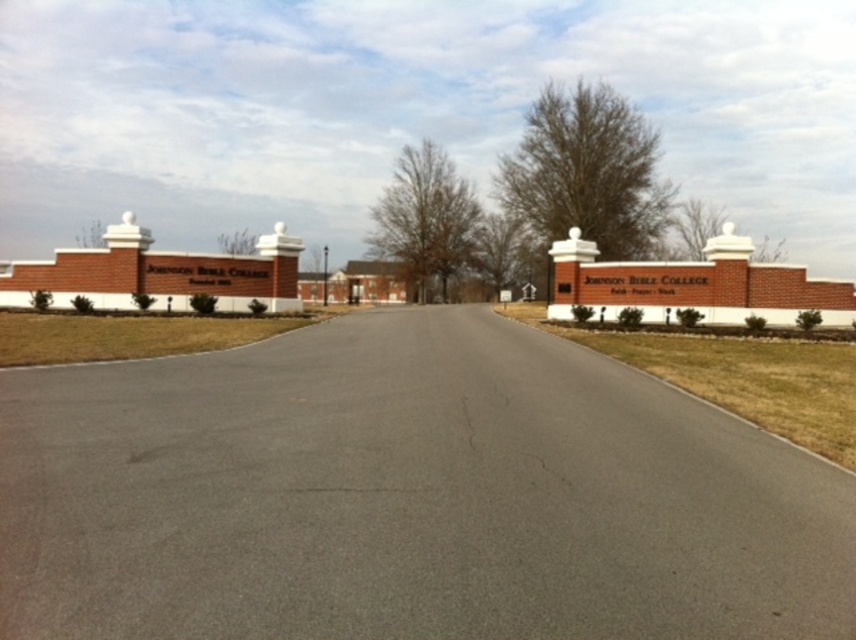
Question: Among these objects, which one is farthest from the camera?

Choices:
 (A) asphalt at center
 (B) brick sign at center
 (C) brick sign at upper left

Answer: (C)

Question: Does brick sign at center appear on the right side of brick sign at upper left?

Choices:
 (A) no
 (B) yes

Answer: (B)

Question: Which of the following is the farthest from the observer?

Choices:
 (A) (569, 296)
 (B) (188, 627)
 (C) (107, 269)

Answer: (A)

Question: Considering the real-world distances, which object is farthest from the asphalt at center?

Choices:
 (A) brick sign at upper left
 (B) brick sign at center

Answer: (A)

Question: Is asphalt at center closer to camera compared to brick sign at upper left?

Choices:
 (A) yes
 (B) no

Answer: (A)

Question: Does asphalt at center have a smaller size compared to brick sign at upper left?

Choices:
 (A) yes
 (B) no

Answer: (A)